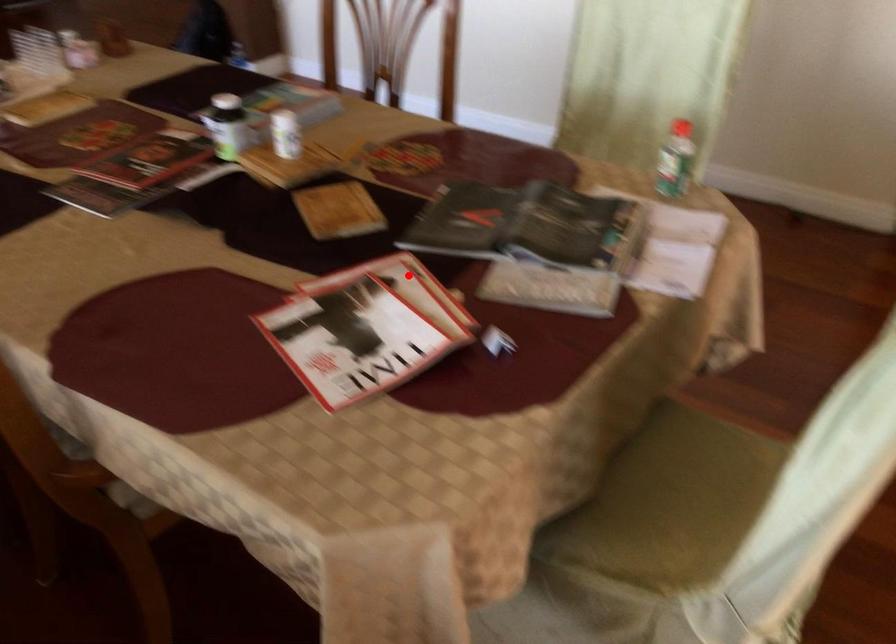
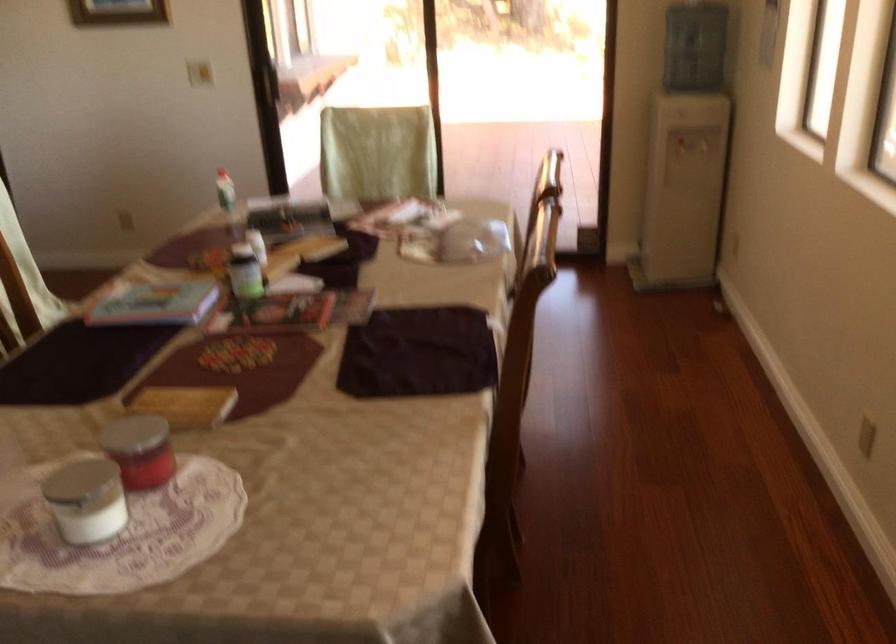
Question: I am providing you with two images of the same scene from different viewpoints. A red point is marked on the first image. Can you still see the location of the red point in image 2?

Choices:
 (A) Yes
 (B) No

Answer: (A)